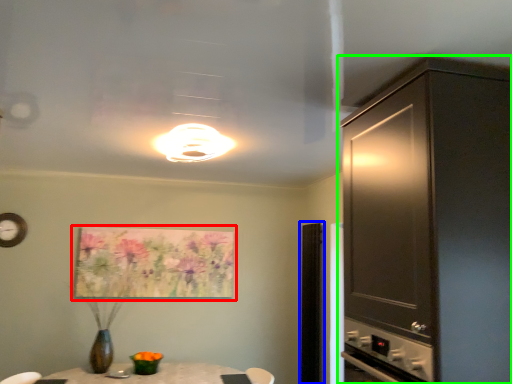
Question: Based on their relative distances, which object is nearer to picture frame (highlighted by a red box)? Choose from glass door (highlighted by a blue box) and cabinetry (highlighted by a green box).

Choices:
 (A) glass door
 (B) cabinetry

Answer: (A)